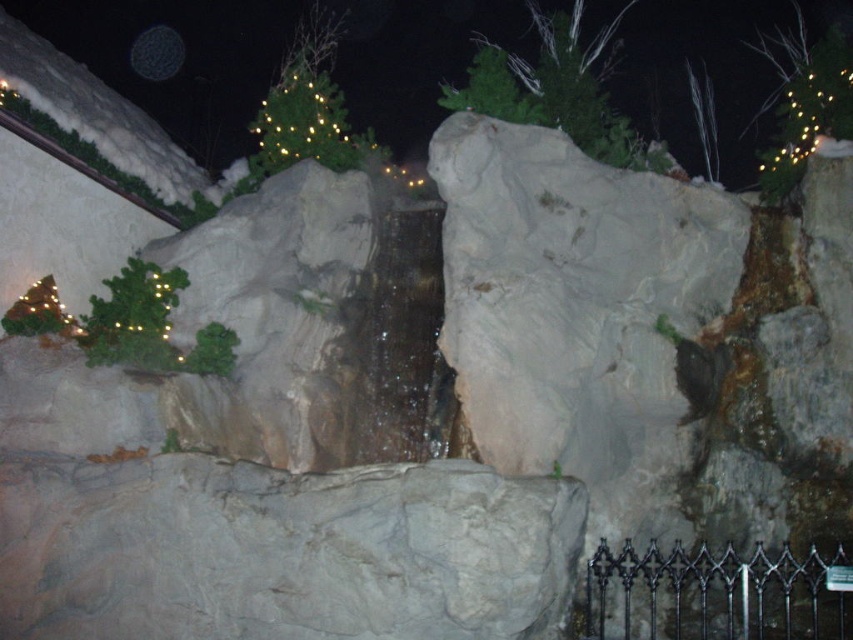
You are standing at the entrance of the themed attraction and see the point marked as point (305, 108). What object is located at that point?

The green matte christmas tree at upper center is located at point (305, 108).

You are a visitor at this themed attraction and want to take a photo of the green matte tree at upper center without the illuminated wire at upper right appearing in the background. Is this possible based on their positions?

The green matte tree at upper center is in front of the illuminated wire at upper right, so if you position yourself so that the tree blocks the wire, you can take a photo without the wire appearing in the background.